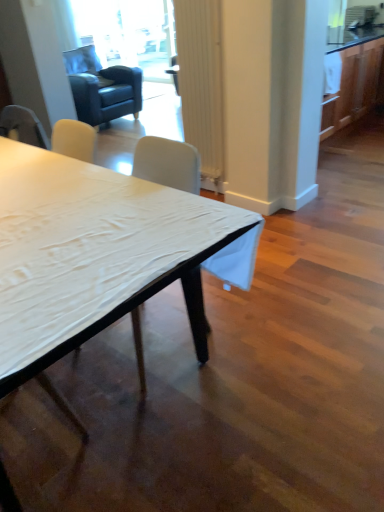
Question: Based on their sizes in the image, would you say white ribbed curtain at center is bigger or smaller than white matte table at center?

Choices:
 (A) big
 (B) small

Answer: (B)

Question: Is white ribbed curtain at center in front of or behind white matte table at center in the image?

Choices:
 (A) behind
 (B) front

Answer: (A)

Question: Based on their relative distances, which object is nearer to the white ribbed curtain at center?

Choices:
 (A) white matte table at center
 (B) transparent glass door at upper center
 (C) dark blue leather swivel chair at upper left
 (D) white fabric chair at center

Answer: (D)

Question: Which object is the farthest from the dark blue leather swivel chair at upper left?

Choices:
 (A) transparent glass door at upper center
 (B) white fabric chair at center
 (C) white matte table at center
 (D) white ribbed curtain at center

Answer: (B)